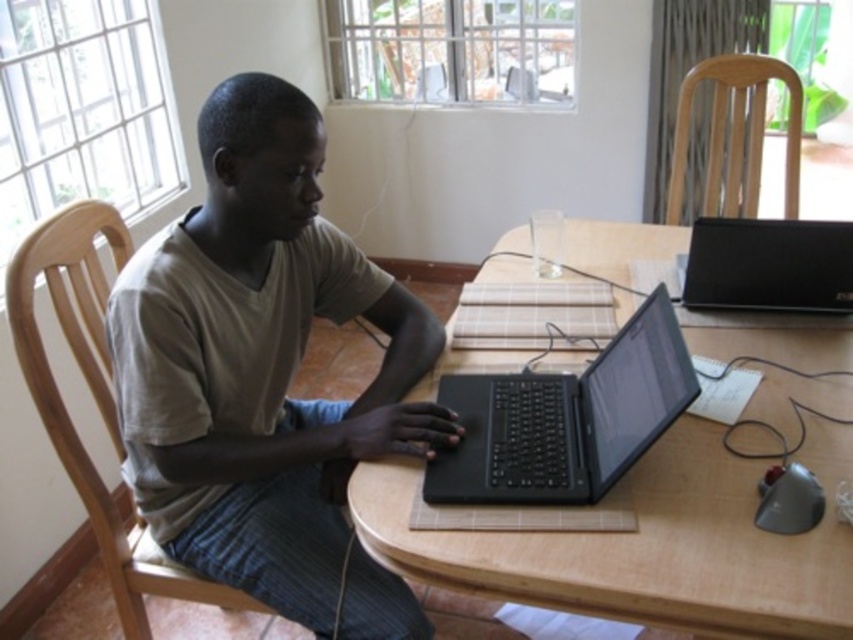
You are trying to place a small object on the wooden table at center. However, there is a shiny black mouse at lower right nearby. Based on their positions, which object is closer to the right edge of the table?

The shiny black mouse at lower right is closer to the right edge of the table since it is positioned to the right of the wooden table at center.

From the picture: You are standing in the room and want to know how far the point at coordinates (372, 538) is from the camera. Can you determine the distance?

The point at coordinates (372, 538) is 1.17 meters away from the camera.